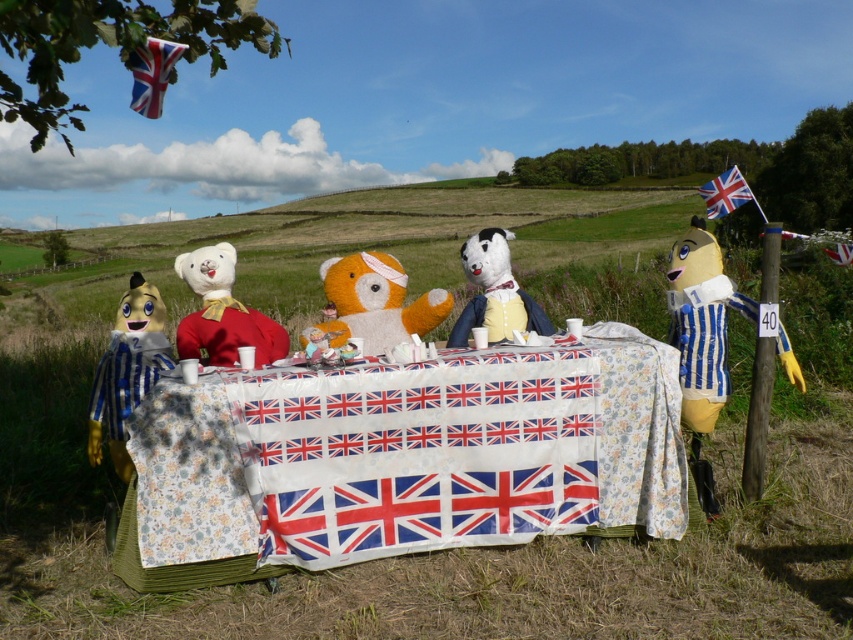
Question: Which point appears farthest from the camera in this image?

Choices:
 (A) (846, 252)
 (B) (485, 285)
 (C) (229, 260)

Answer: (B)

Question: Among these objects, which one is nearest to the camera?

Choices:
 (A) yellow striped fabric at right
 (B) union jack fabric flag at upper right
 (C) fluffy orange teddy bear at center
 (D) floral fabric table at center

Answer: (D)

Question: Does fluffy orange teddy bear at center appear under velvet-like white dog at center?

Choices:
 (A) yes
 (B) no

Answer: (B)

Question: Among these points, which one is nearest to the camera?

Choices:
 (A) (144, 362)
 (B) (843, 253)
 (C) (264, 317)

Answer: (A)

Question: Is yellow striped fabric at right to the right of fluffy orange teddy bear at center from the viewer's perspective?

Choices:
 (A) no
 (B) yes

Answer: (B)

Question: Does white plush bear at center appear under velvet-like white dog at center?

Choices:
 (A) no
 (B) yes

Answer: (A)